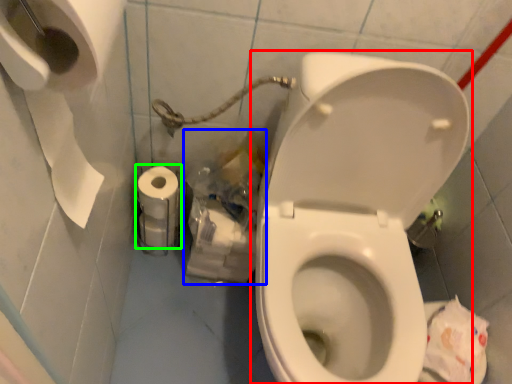
Question: Based on their relative distances, which object is nearer to toilet (highlighted by a red box)? Choose from garbage (highlighted by a blue box) and toilet paper (highlighted by a green box).

Choices:
 (A) garbage
 (B) toilet paper

Answer: (A)